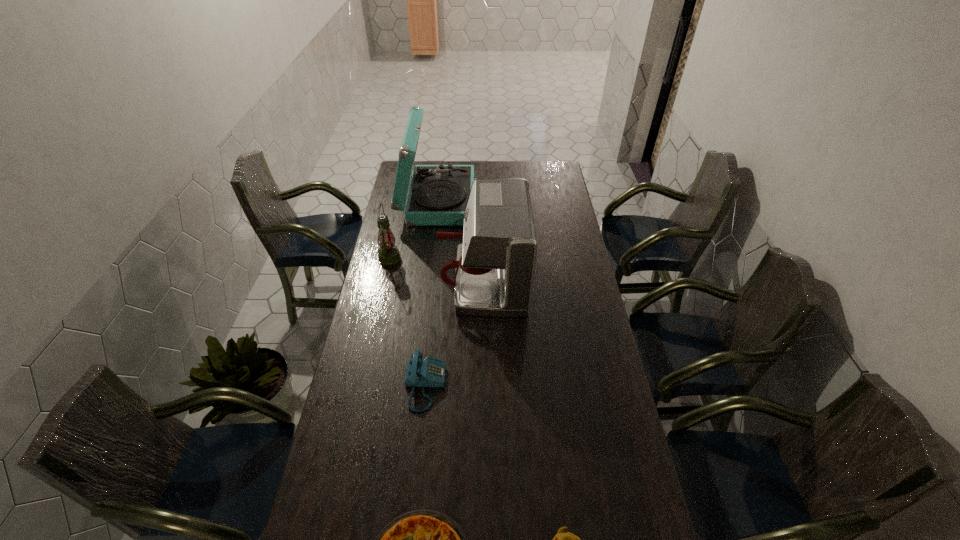
Find the location of a particular element. record player is located at coordinates (438, 194).

The image size is (960, 540). I want to click on coffee maker, so click(495, 268).

The image size is (960, 540). I want to click on the third tallest object, so click(x=388, y=253).

Locate an element on the screen. The width and height of the screenshot is (960, 540). telephone is located at coordinates (431, 372).

Locate an element on the screen. This screenshot has height=540, width=960. the third shortest object is located at coordinates (431, 372).

This screenshot has height=540, width=960. Find the location of `free space located 0.310m on the face side of the record player`. free space located 0.310m on the face side of the record player is located at coordinates (540, 201).

At what (x,y) coordinates should I click in order to perform the action: click on vacant position located 0.160m on the front of the coffee maker near the spout. Please return your answer as a coordinate pair (x, y). The height and width of the screenshot is (540, 960). Looking at the image, I should click on (400, 281).

The height and width of the screenshot is (540, 960). I want to click on free region located 0.260m on the front of the coffee maker near the spout, so click(x=376, y=281).

At what (x,y) coordinates should I click in order to perform the action: click on vacant space positioned 0.110m on the front of the coffee maker near the spout. Please return your answer as a coordinate pair (x, y). Looking at the image, I should click on (412, 281).

The image size is (960, 540). In order to click on vacant position located on the right of the oil lamp in this screenshot , I will do `click(430, 258)`.